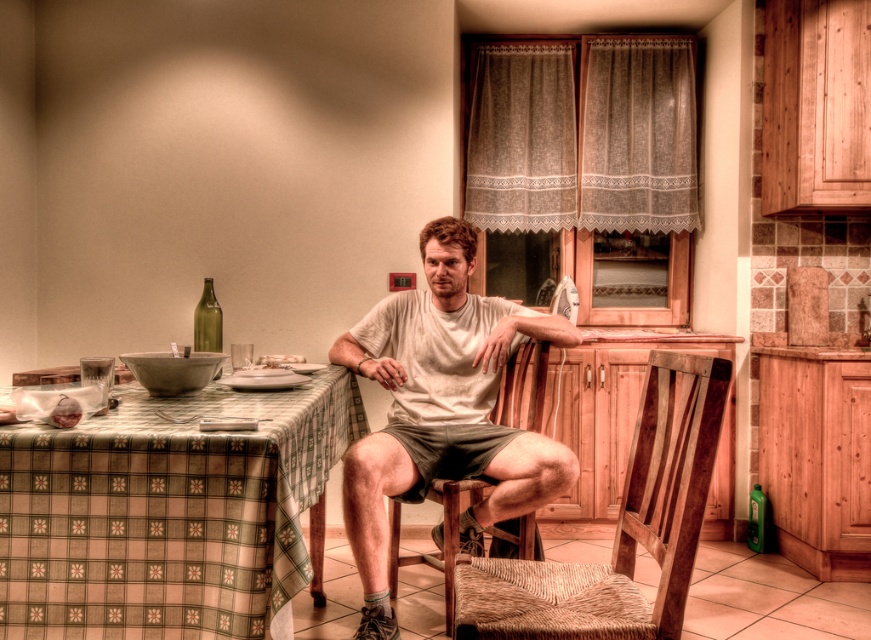
Is green checkered tablecloth at lower left below matte white t-shirt at center?

No.

Does green checkered tablecloth at lower left have a smaller size compared to matte white t-shirt at center?

Indeed, green checkered tablecloth at lower left has a smaller size compared to matte white t-shirt at center.

Which is behind, point (62, 486) or point (388, 305)?

The point (388, 305) is behind.

You are a GUI agent. You are given a task and a screenshot of the screen. Output one action in this format:
    pyautogui.click(x=<x>, y=<y>)
    Task: Click on the green checkered tablecloth at lower left
    The height and width of the screenshot is (640, 871).
    Given the screenshot: What is the action you would take?
    pyautogui.click(x=166, y=513)

Does matte white t-shirt at center lie in front of green glass bottle at table left?

Yes.

Is matte white t-shirt at center smaller than green glass bottle at table left?

Incorrect, matte white t-shirt at center is not smaller in size than green glass bottle at table left.

Is point (431, 300) in front of point (196, 320)?

Yes.

The width and height of the screenshot is (871, 640). Identify the location of matte white t-shirt at center. (441, 408).

Describe the element at coordinates (166, 513) in the screenshot. I see `green checkered tablecloth at lower left` at that location.

Measure the distance between point (113, 586) and camera.

Point (113, 586) and camera are 5.22 feet apart.

Identify the location of green checkered tablecloth at lower left. (166, 513).